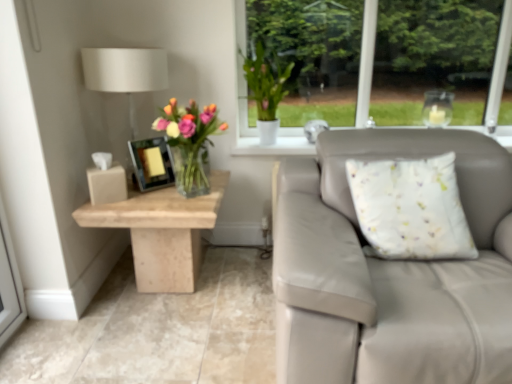
Question: Would you say beige marble table at left is a long distance from translucent glass vase at center?

Choices:
 (A) no
 (B) yes

Answer: (A)

Question: From the image's perspective, is beige marble table at left below translucent glass vase at center?

Choices:
 (A) no
 (B) yes

Answer: (B)

Question: From a real-world perspective, is beige marble table at left below translucent glass vase at center?

Choices:
 (A) no
 (B) yes

Answer: (B)

Question: Considering the relative sizes of beige marble table at left and translucent glass vase at center in the image provided, is beige marble table at left shorter than translucent glass vase at center?

Choices:
 (A) no
 (B) yes

Answer: (A)

Question: Can you confirm if beige marble table at left is positioned to the left of translucent glass vase at center?

Choices:
 (A) yes
 (B) no

Answer: (A)

Question: Does beige marble table at left come in front of translucent glass vase at center?

Choices:
 (A) yes
 (B) no

Answer: (B)

Question: From a real-world perspective, does white fabric cushion at right stand above white matte vase at upper center?

Choices:
 (A) no
 (B) yes

Answer: (A)

Question: From the image's perspective, is white fabric cushion at right under white matte vase at upper center?

Choices:
 (A) yes
 (B) no

Answer: (A)

Question: Can you confirm if white fabric cushion at right is wider than white matte vase at upper center?

Choices:
 (A) yes
 (B) no

Answer: (B)

Question: Is white fabric cushion at right oriented towards white matte vase at upper center?

Choices:
 (A) yes
 (B) no

Answer: (B)

Question: Would you say white matte vase at upper center is part of white fabric cushion at right's contents?

Choices:
 (A) no
 (B) yes

Answer: (A)

Question: Considering the relative sizes of white fabric cushion at right and white matte vase at upper center in the image provided, is white fabric cushion at right shorter than white matte vase at upper center?

Choices:
 (A) yes
 (B) no

Answer: (B)

Question: Is white fabric cushion at right positioned beyond the bounds of translucent glass vase at center?

Choices:
 (A) no
 (B) yes

Answer: (B)